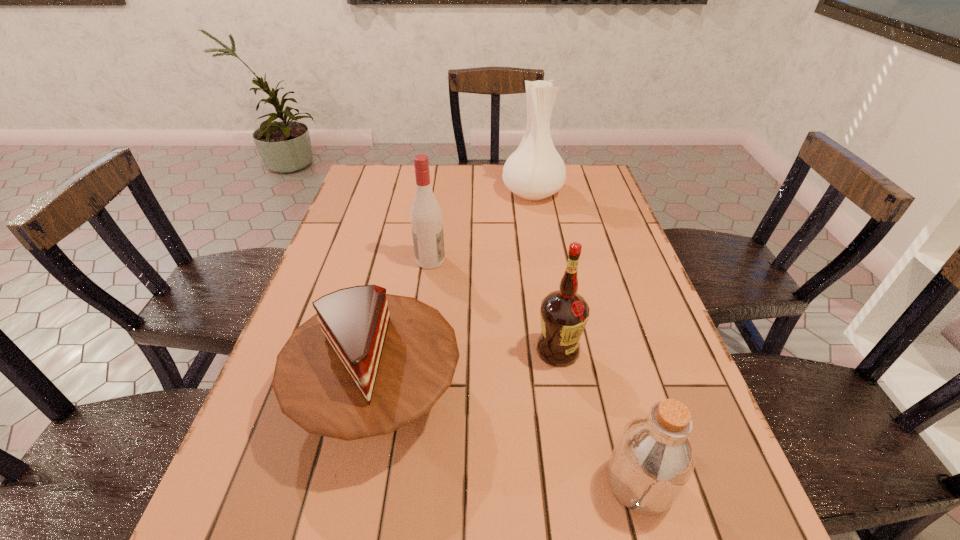
At what (x,y) coordinates should I click in order to perform the action: click on vacant region that satisfies the following two spatial constraints: 1. on the back side of the bottle; 2. on the label of the farther alcohol. Please return your answer as a coordinate pair (x, y). The image size is (960, 540). Looking at the image, I should click on (580, 260).

Identify the location of free location that satisfies the following two spatial constraints: 1. on the label of the nearer alcohol; 2. on the left side of the bottle. (581, 483).

At what (x,y) coordinates should I click in order to perform the action: click on blank area in the image that satisfies the following two spatial constraints: 1. on the label of the left alcohol; 2. on the front side of the cake. Please return your answer as a coordinate pair (x, y). The image size is (960, 540). Looking at the image, I should click on (412, 396).